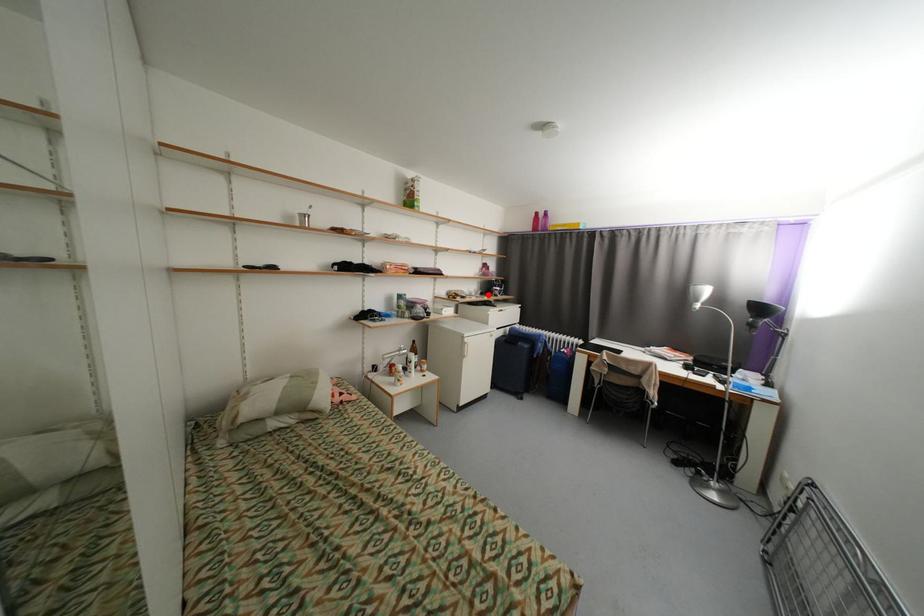
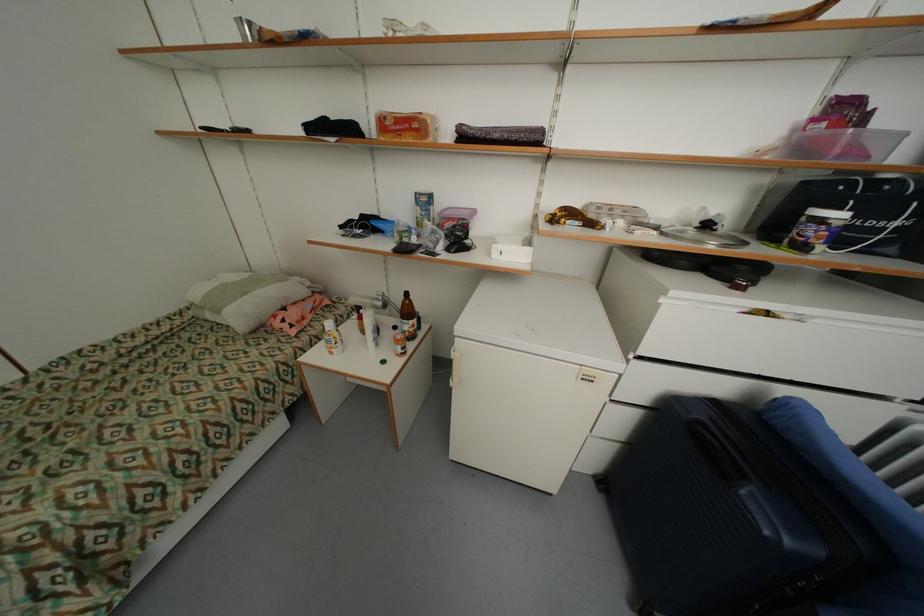
Locate, in the second image, the point that corresponds to the highlighted location in the first image.

(713, 227)